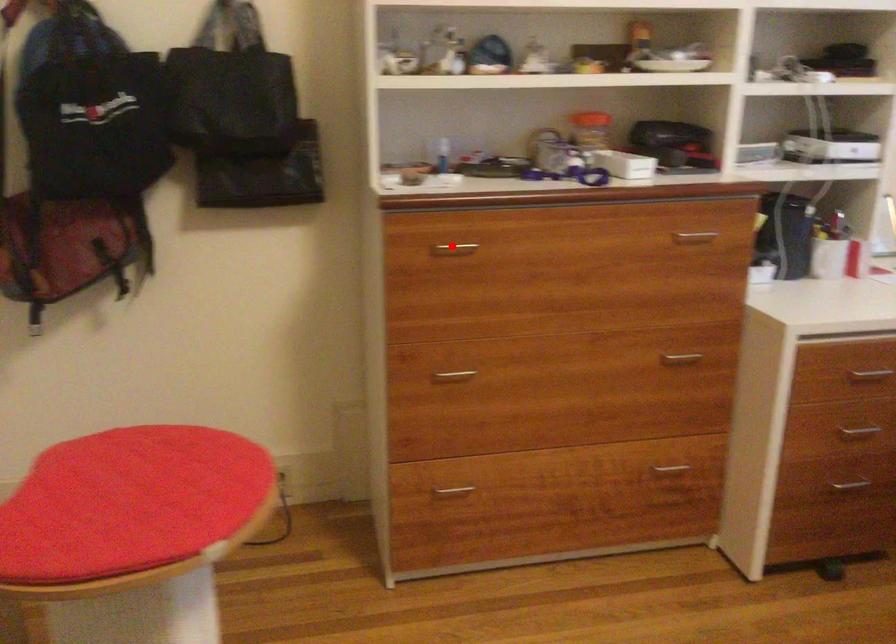
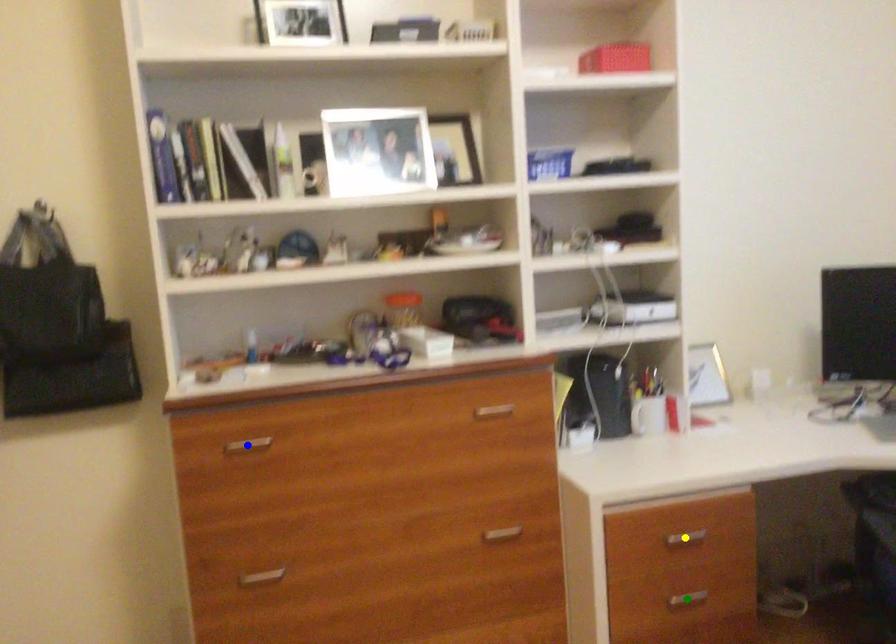
Question: I am providing you with two images of the same scene from different viewpoints. A red point is marked on the first image. You are given multiple points on the second image. Which point in image 2 is actually the same real-world point as the red point in image 1?

Choices:
 (A) yellow point
 (B) blue point
 (C) green point

Answer: (B)